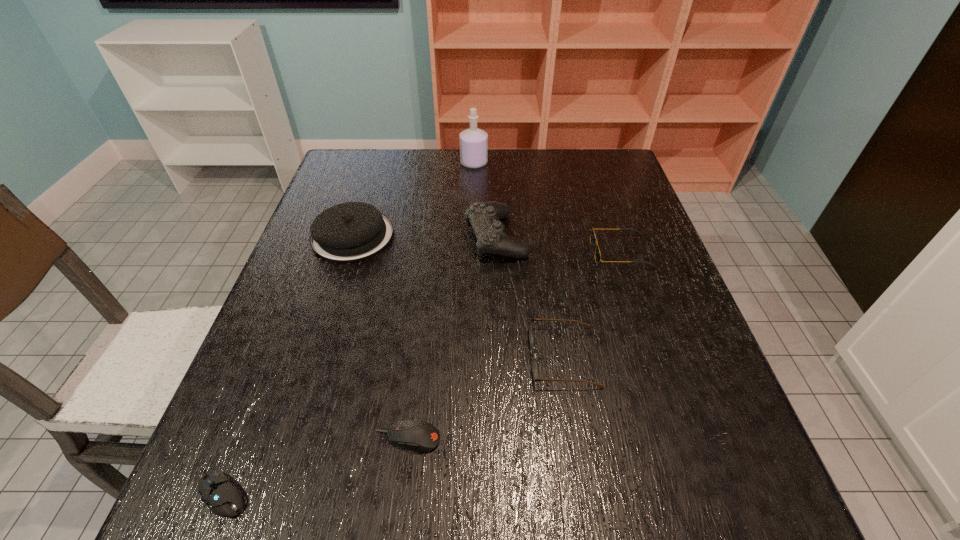
Image resolution: width=960 pixels, height=540 pixels. What are the coordinates of `the nearer computer mouse` in the screenshot? It's located at (222, 497).

Where is `free region located on the left of the tallest object`? This screenshot has width=960, height=540. free region located on the left of the tallest object is located at coordinates (375, 163).

What are the coordinates of `vacant space located 0.160m on the right of the second tallest object` in the screenshot? It's located at (589, 237).

Find the location of a particular element. free space located on the front of the pancake is located at coordinates (320, 340).

Where is `vacant space situated 0.280m on the front-facing side of the rightmost object`? The height and width of the screenshot is (540, 960). vacant space situated 0.280m on the front-facing side of the rightmost object is located at coordinates (481, 252).

I want to click on blank space located on the front-facing side of the rightmost object, so click(437, 252).

Where is `vacant space located 0.150m on the front-facing side of the rightmost object`? vacant space located 0.150m on the front-facing side of the rightmost object is located at coordinates (533, 252).

In order to click on vacant space situated 0.270m on the front-facing side of the fifth farthest object in this screenshot , I will do pos(396,356).

Where is `free space located on the front-facing side of the fifth farthest object`? free space located on the front-facing side of the fifth farthest object is located at coordinates (470, 356).

Locate an element on the screen. This screenshot has width=960, height=540. vacant space located 0.230m on the front-facing side of the fifth farthest object is located at coordinates (416, 356).